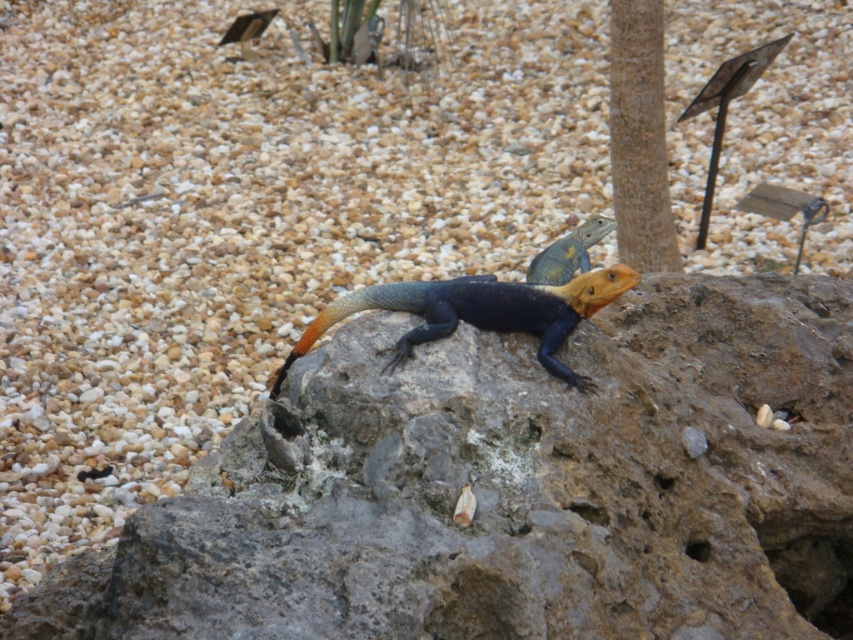
Is rough stone boulder at center taller than shiny blue lizard at center?

Yes.

Is rough stone boulder at center to the left of shiny blue lizard at center from the viewer's perspective?

Incorrect, rough stone boulder at center is not on the left side of shiny blue lizard at center.

Where is `rough stone boulder at center`? The image size is (853, 640). rough stone boulder at center is located at coordinates (512, 486).

Where is `rough stone boulder at center`? Image resolution: width=853 pixels, height=640 pixels. rough stone boulder at center is located at coordinates click(512, 486).

Can you confirm if shiny blue lizard at center is positioned to the right of smooth brown pole at upper center?

In fact, shiny blue lizard at center is to the left of smooth brown pole at upper center.

Does shiny blue lizard at center have a smaller size compared to smooth brown pole at upper center?

Indeed, shiny blue lizard at center has a smaller size compared to smooth brown pole at upper center.

This screenshot has height=640, width=853. Find the location of `shiny blue lizard at center`. shiny blue lizard at center is located at coordinates (480, 312).

Find the location of a particular element. Image resolution: width=853 pixels, height=640 pixels. shiny blue lizard at center is located at coordinates (x=480, y=312).

Can you confirm if rough stone boulder at center is positioned below smooth brown pole at upper center?

Correct, rough stone boulder at center is located below smooth brown pole at upper center.

Is rough stone boulder at center taller than smooth brown pole at upper center?

Yes, rough stone boulder at center is taller than smooth brown pole at upper center.

The image size is (853, 640). Identify the location of rough stone boulder at center. (512, 486).

Image resolution: width=853 pixels, height=640 pixels. Identify the location of rough stone boulder at center. (512, 486).